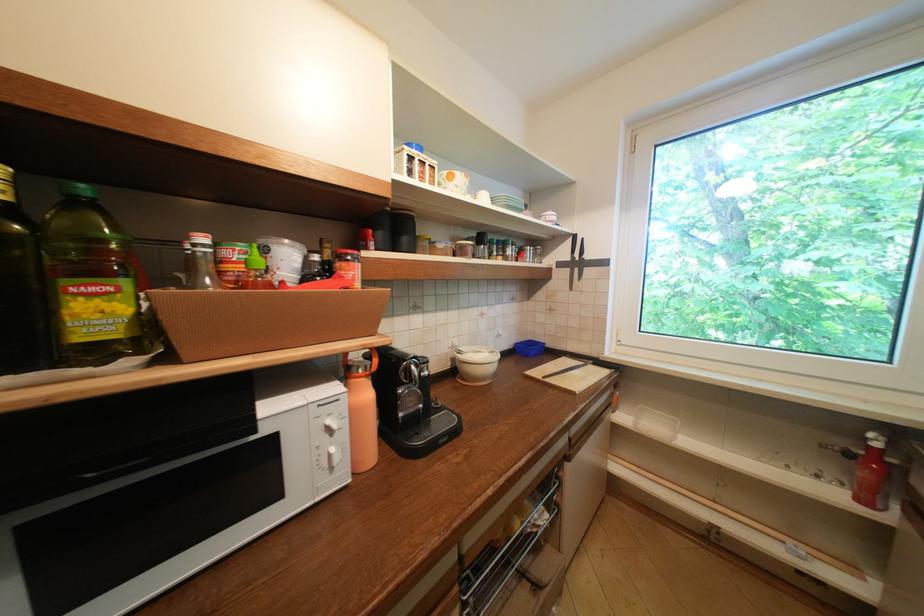
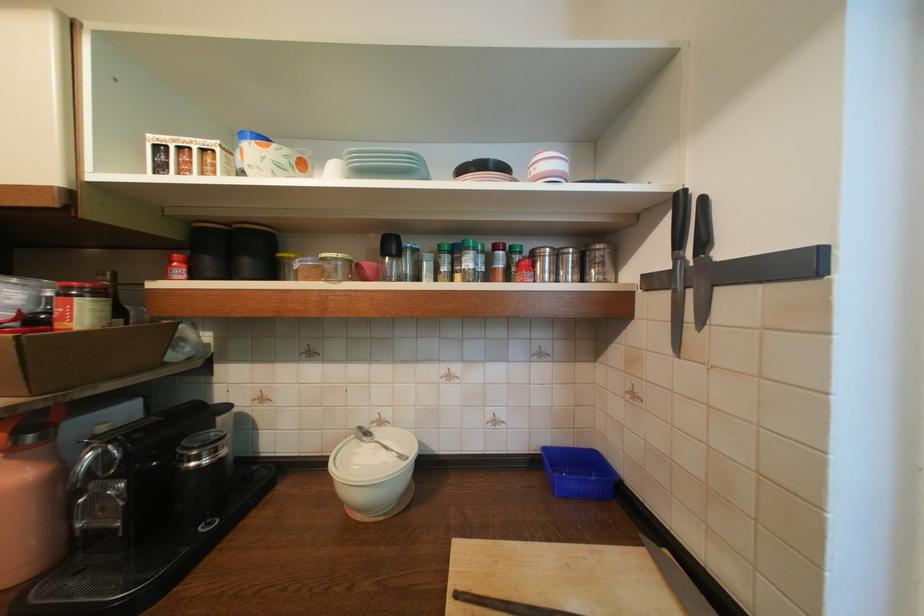
Find the pixel in the second image that matches the point at 549,256 in the first image.

(611, 265)